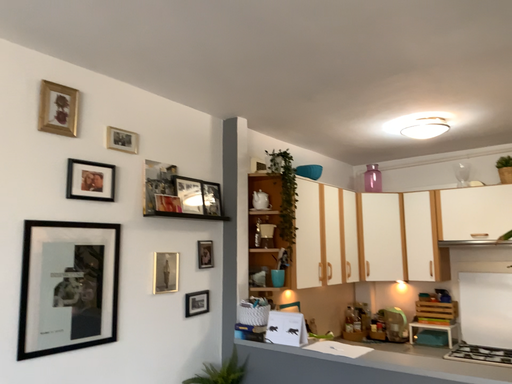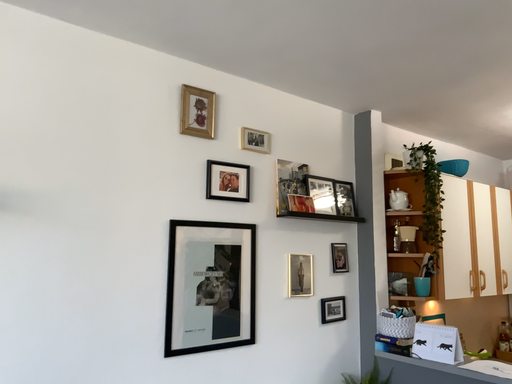
Question: How did the camera likely rotate when shooting the video?

Choices:
 (A) rotated right
 (B) rotated left

Answer: (B)